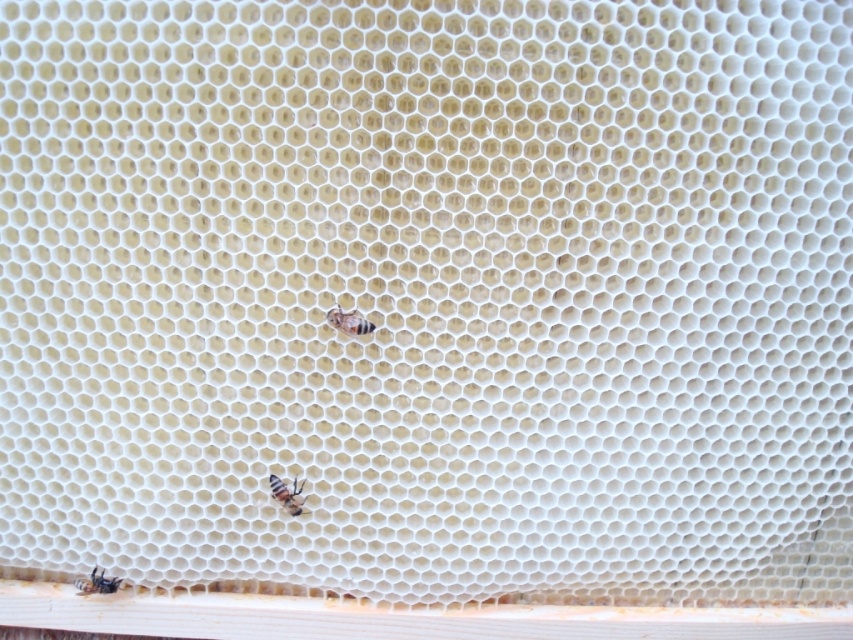
Based on the photo, you are a beekeeper examining the honeycomb. You notice a translucent yellow bee at lower center and a translucent yellowish honeycomb at lower left. Which one is taller?

The translucent yellow bee at lower center is taller than the translucent yellowish honeycomb at lower left.

You are a beekeeper examining a honeycomb. You notice the translucent yellowish honeycomb at center and the translucent yellow bee at lower center. Which object occupies more horizontal space in the image?

The translucent yellowish honeycomb at center might be wider than the translucent yellow bee at lower center, so it likely occupies more horizontal space in the image.